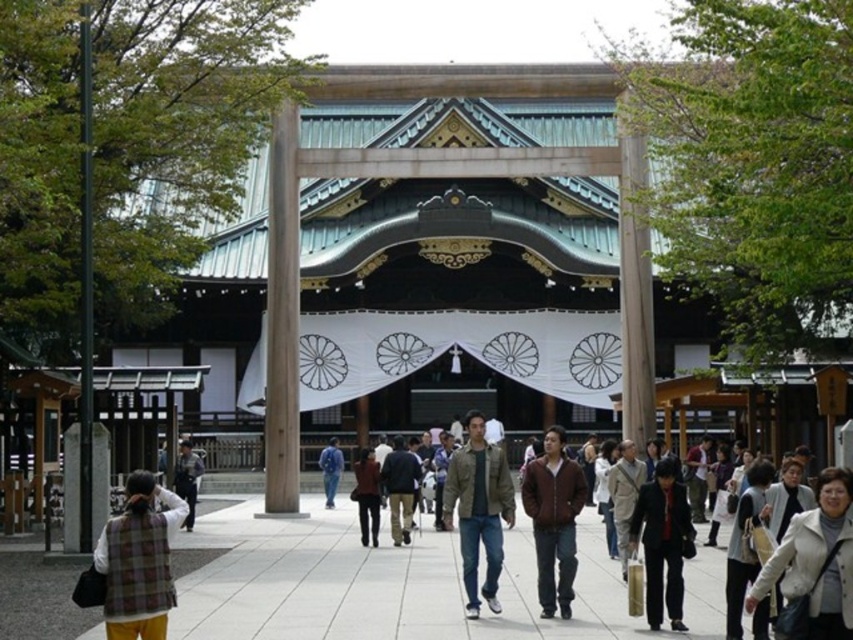
Does plaid fabric vest at lower left have a larger size compared to white leather jacket at lower right?

No, plaid fabric vest at lower left is not bigger than white leather jacket at lower right.

The width and height of the screenshot is (853, 640). I want to click on plaid fabric vest at lower left, so click(138, 561).

Consider the image. Who is higher up, plaid fabric vest at lower left or dark brown leather jacket at lower right?

Positioned higher is dark brown leather jacket at lower right.

Can you confirm if plaid fabric vest at lower left is wider than dark brown leather jacket at lower right?

In fact, plaid fabric vest at lower left might be narrower than dark brown leather jacket at lower right.

The image size is (853, 640). What are the coordinates of `plaid fabric vest at lower left` in the screenshot? It's located at (138, 561).

This screenshot has height=640, width=853. I want to click on plaid fabric vest at lower left, so click(138, 561).

In the scene shown: Who is more forward, (x=819, y=604) or (x=554, y=429)?

Positioned in front is point (x=819, y=604).

Measure the distance between white leather jacket at lower right and camera.

59.54 meters

The height and width of the screenshot is (640, 853). Identify the location of white leather jacket at lower right. (816, 561).